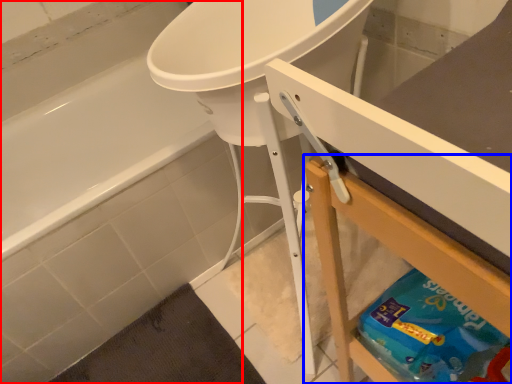
Question: Which object appears closest to the camera in this image, bathtub (highlighted by a red box) or counter (highlighted by a blue box)?

Choices:
 (A) bathtub
 (B) counter

Answer: (B)